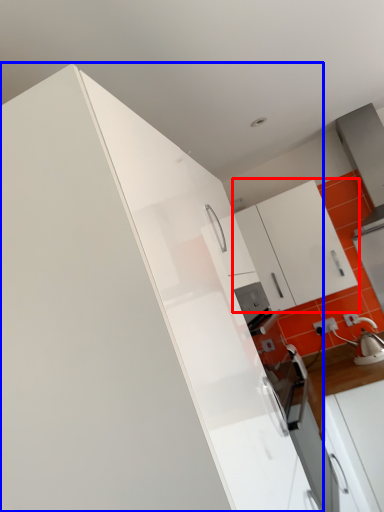
Question: Which point is further to the camera, cabinetry (highlighted by a red box) or cabinetry (highlighted by a blue box)?

Choices:
 (A) cabinetry
 (B) cabinetry

Answer: (A)